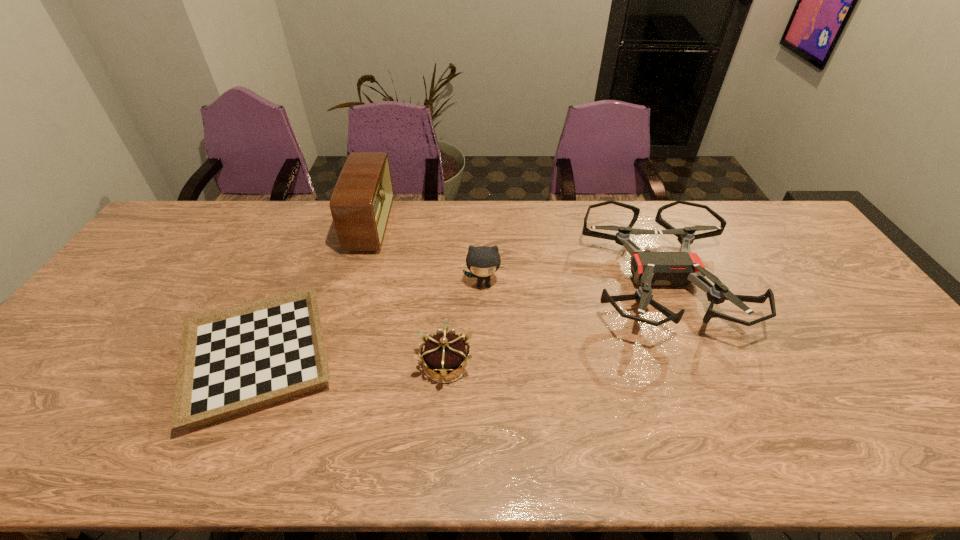
Locate an element on the screen. The image size is (960, 540). radio receiver situated at the far edge is located at coordinates (361, 202).

You are a GUI agent. You are given a task and a screenshot of the screen. Output one action in this format:
    pyautogui.click(x=<x>, y=<y>)
    Task: Click on the drone that is positioned at the far edge
    Image resolution: width=960 pixels, height=540 pixels.
    Given the screenshot: What is the action you would take?
    pyautogui.click(x=677, y=269)

Find the location of a particular element. Image resolution: width=960 pixels, height=540 pixels. object that is at the near edge is located at coordinates (234, 360).

The height and width of the screenshot is (540, 960). What are the coordinates of `vacant space at the far edge of the desktop` in the screenshot? It's located at click(x=699, y=212).

Where is `free spot at the near edge of the desktop`? This screenshot has width=960, height=540. free spot at the near edge of the desktop is located at coordinates (322, 465).

Where is `free space at the left edge`? This screenshot has width=960, height=540. free space at the left edge is located at coordinates click(x=99, y=367).

Image resolution: width=960 pixels, height=540 pixels. In the image, there is a desktop. Identify the location of vacant space at the right edge. (910, 361).

In the image, there is a desktop. Where is `vacant space at the far left corner`? vacant space at the far left corner is located at coordinates (208, 201).

I want to click on free spot at the far right corner of the desktop, so click(x=742, y=213).

At what (x,y) coordinates should I click in order to perform the action: click on free space at the near right corner of the desktop. Please return your answer as a coordinate pair (x, y). The width and height of the screenshot is (960, 540). Looking at the image, I should click on (948, 467).